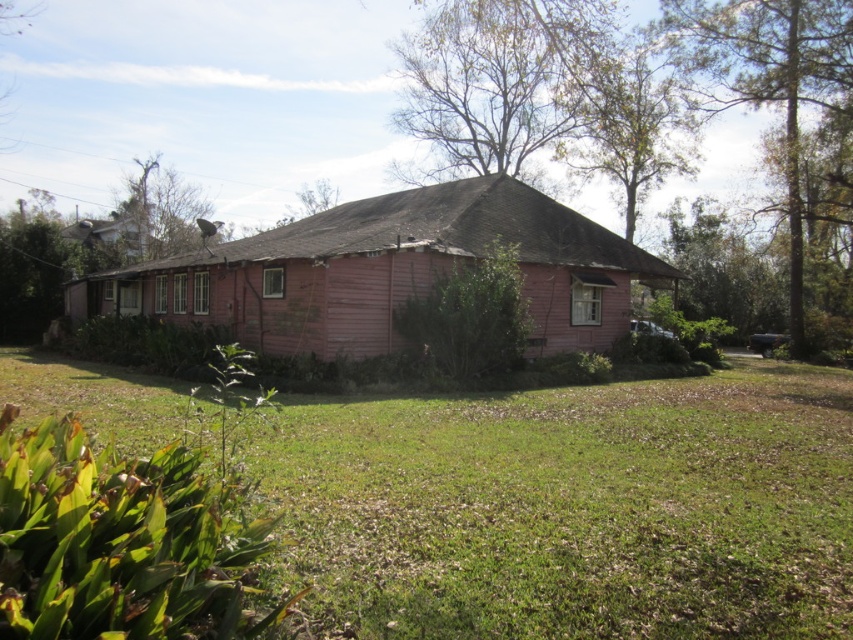
Question: Does pink wood house at center appear on the left side of brown textured tree at upper left?

Choices:
 (A) yes
 (B) no

Answer: (B)

Question: Is green leafy bush at center wider than metallic satellite dish at upper left?

Choices:
 (A) yes
 (B) no

Answer: (B)

Question: Which of the following is the farthest from the observer?

Choices:
 (A) brown textured tree at upper left
 (B) green leafy tree at upper right
 (C) green leafy bush at center
 (D) metallic satellite dish at upper left

Answer: (D)

Question: Which object is positioned farthest from the green leafy bush at center?

Choices:
 (A) bare wood tree at upper center
 (B) metallic satellite dish at upper left

Answer: (B)

Question: Which object is positioned closest to the bare wood tree at upper center?

Choices:
 (A) green grass at lower center
 (B) green leafy tree at upper right
 (C) pink wood house at center
 (D) green leafy bush at center

Answer: (B)

Question: Can you confirm if pink wood house at center is smaller than green leafy tree at upper right?

Choices:
 (A) no
 (B) yes

Answer: (A)